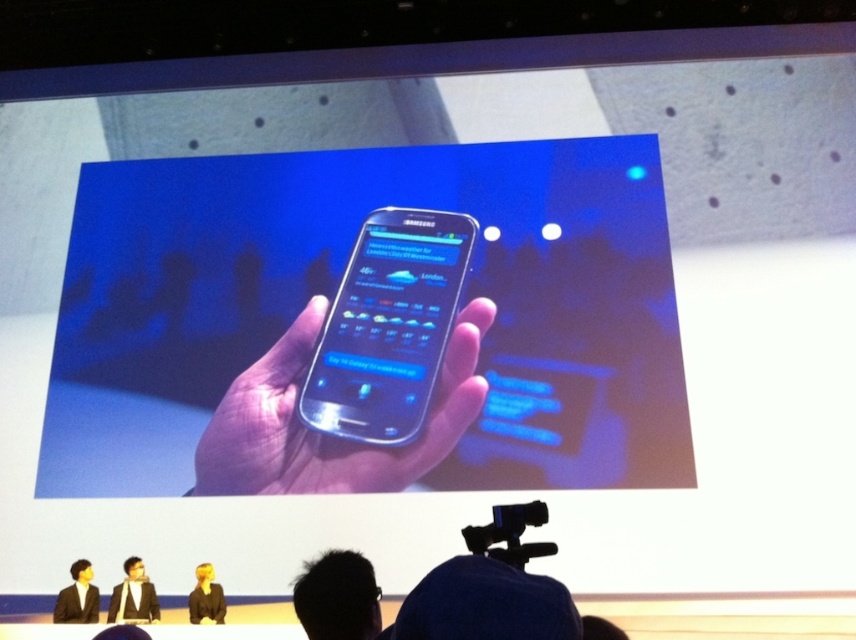
Question: Is transparent plastic phone at center further to the viewer compared to black plastic video camera at lower center?

Choices:
 (A) no
 (B) yes

Answer: (B)

Question: Which of these objects is positioned closest to the metallic silver phone at center?

Choices:
 (A) black suit at center
 (B) transparent plastic phone at center
 (C) dark suit at center

Answer: (B)

Question: Does black plastic video camera at lower center appear on the left side of dark suit at center?

Choices:
 (A) yes
 (B) no

Answer: (B)

Question: Considering the relative positions of dark suit at center and black suit at lower center in the image provided, where is dark suit at center located with respect to black suit at lower center?

Choices:
 (A) below
 (B) above

Answer: (B)

Question: Which object is farther from the camera taking this photo?

Choices:
 (A) metallic silver phone at center
 (B) black suit at center

Answer: (A)

Question: Which object appears farthest from the camera in this image?

Choices:
 (A) dark suit at center
 (B) transparent plastic phone at center
 (C) black suit at lower center
 (D) black plastic video camera at lower center

Answer: (B)